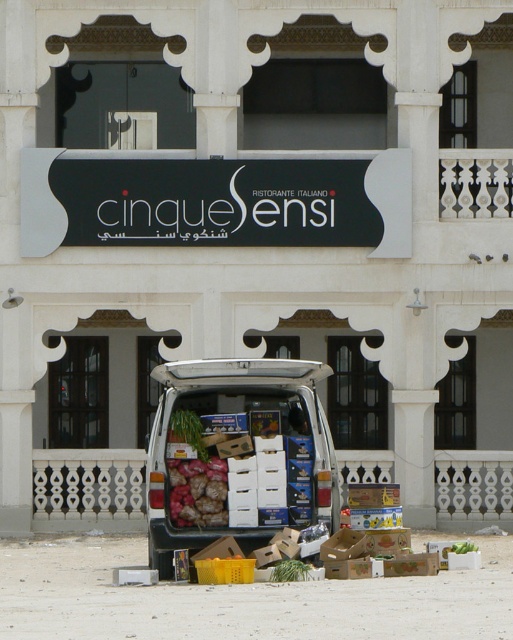
Question: Considering the relative positions of white cardboard minivan at center and reddish-brown textured bag at center in the image provided, where is white cardboard minivan at center located with respect to reddish-brown textured bag at center?

Choices:
 (A) below
 (B) above

Answer: (B)

Question: Among these objects, which one is nearest to the camera?

Choices:
 (A) white cardboard minivan at center
 (B) reddish-brown textured bag at center

Answer: (A)

Question: Can you confirm if white cardboard minivan at center is smaller than reddish-brown textured bag at center?

Choices:
 (A) yes
 (B) no

Answer: (B)

Question: Which object is closer to the camera taking this photo?

Choices:
 (A) reddish-brown textured bag at center
 (B) white cardboard minivan at center

Answer: (B)

Question: Is white cardboard minivan at center to the right of reddish-brown textured bag at center from the viewer's perspective?

Choices:
 (A) yes
 (B) no

Answer: (A)